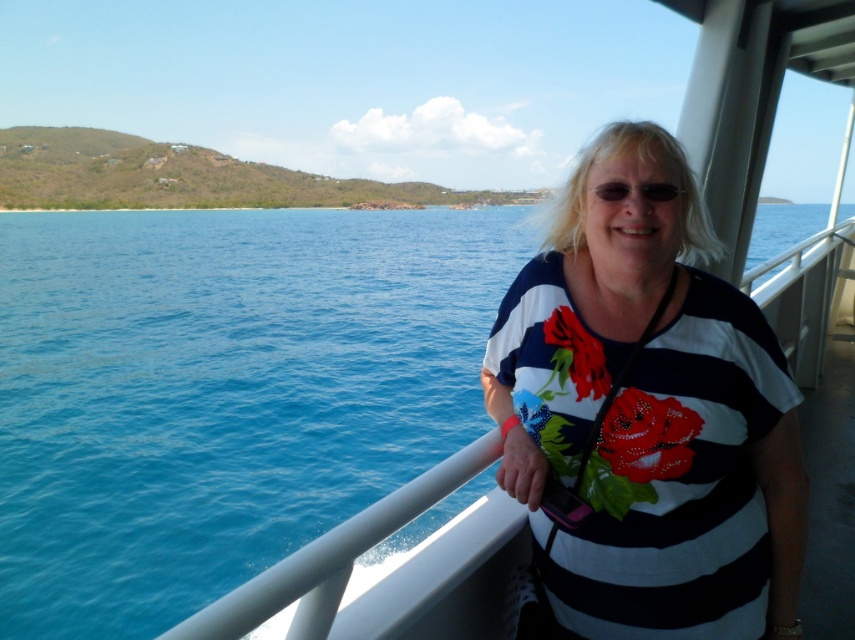
Question: Estimate the real-world distances between objects in this image. Which object is closer to the black plastic sunglasses at center?

Choices:
 (A) striped fabric shirt at center
 (B) blue water at center

Answer: (A)

Question: Observing the image, what is the correct spatial positioning of blue water at center in reference to striped fabric shirt at center?

Choices:
 (A) left
 (B) right

Answer: (A)

Question: Does blue water at center appear over black plastic sunglasses at center?

Choices:
 (A) no
 (B) yes

Answer: (B)

Question: Estimate the real-world distances between objects in this image. Which object is closer to the blue water at center?

Choices:
 (A) black plastic sunglasses at center
 (B) striped fabric shirt at center

Answer: (B)

Question: Which object is the closest to the black plastic sunglasses at center?

Choices:
 (A) striped fabric shirt at center
 (B) blue water at center

Answer: (A)

Question: Can you confirm if blue water at center is thinner than striped fabric shirt at center?

Choices:
 (A) yes
 (B) no

Answer: (B)